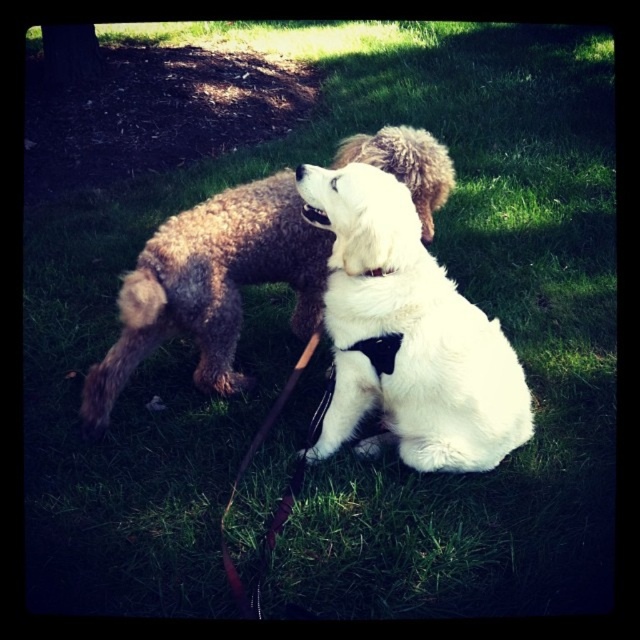
Who is taller, black fabric neckband at center or black leather neckband at center?

Standing taller between the two is black fabric neckband at center.

The height and width of the screenshot is (640, 640). Identify the location of black fabric neckband at center. (378, 349).

Is fluffy brown dog at center smaller than white fluffy dog at center?

Incorrect, fluffy brown dog at center is not smaller in size than white fluffy dog at center.

Is point (88, 388) positioned after point (392, 147)?

Yes, point (88, 388) is farther from viewer.

Locate an element on the screen. This screenshot has height=640, width=640. fluffy brown dog at center is located at coordinates (211, 285).

Who is positioned more to the right, white soft fur dog at center or fluffy brown dog at center?

white soft fur dog at center is more to the right.

Image resolution: width=640 pixels, height=640 pixels. What do you see at coordinates (408, 333) in the screenshot?
I see `white soft fur dog at center` at bounding box center [408, 333].

You are a GUI agent. You are given a task and a screenshot of the screen. Output one action in this format:
    pyautogui.click(x=<x>, y=<y>)
    Task: Click on the white soft fur dog at center
    The height and width of the screenshot is (640, 640).
    Given the screenshot: What is the action you would take?
    pyautogui.click(x=408, y=333)